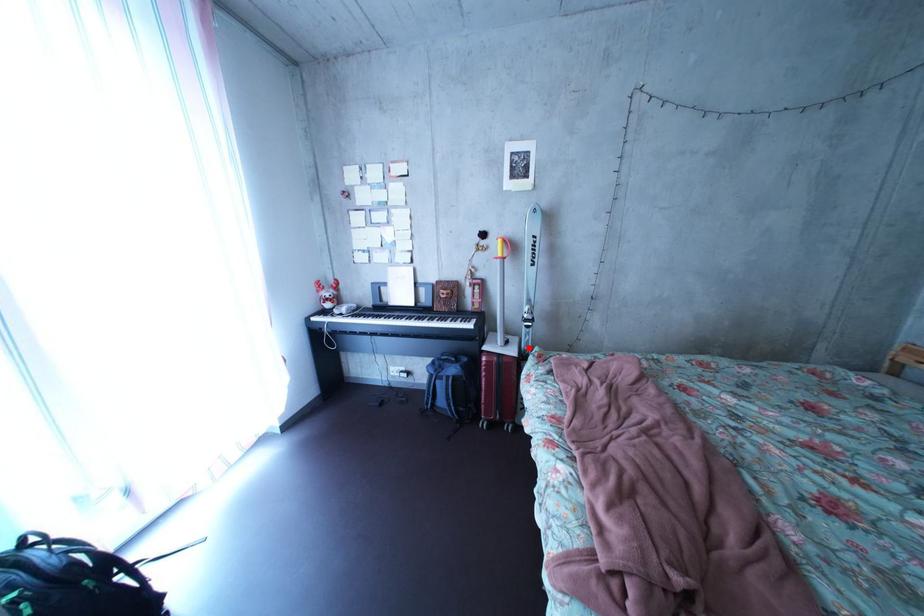
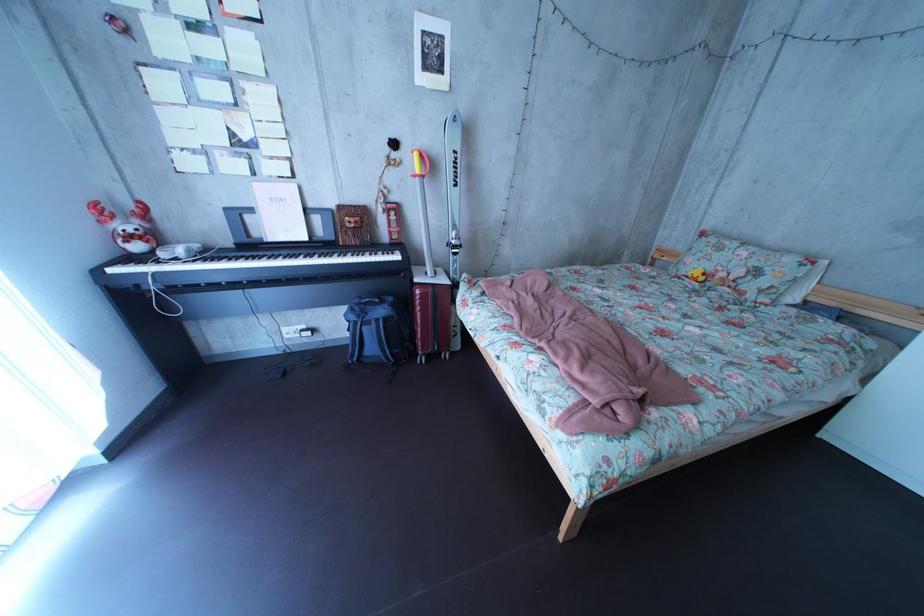
In the second image, find the point that corresponds to the highlighted location in the first image.

(455, 278)